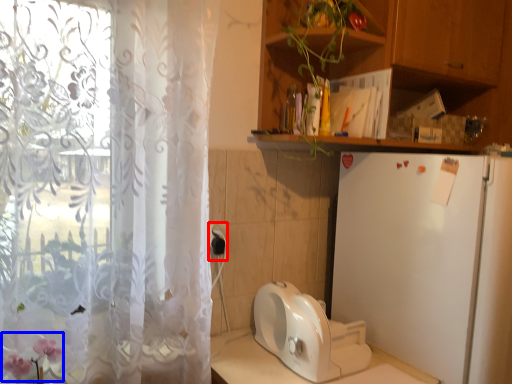
Question: Among these objects, which one is farthest to the camera, electric outlet (highlighted by a red box) or flower (highlighted by a blue box)?

Choices:
 (A) electric outlet
 (B) flower

Answer: (A)